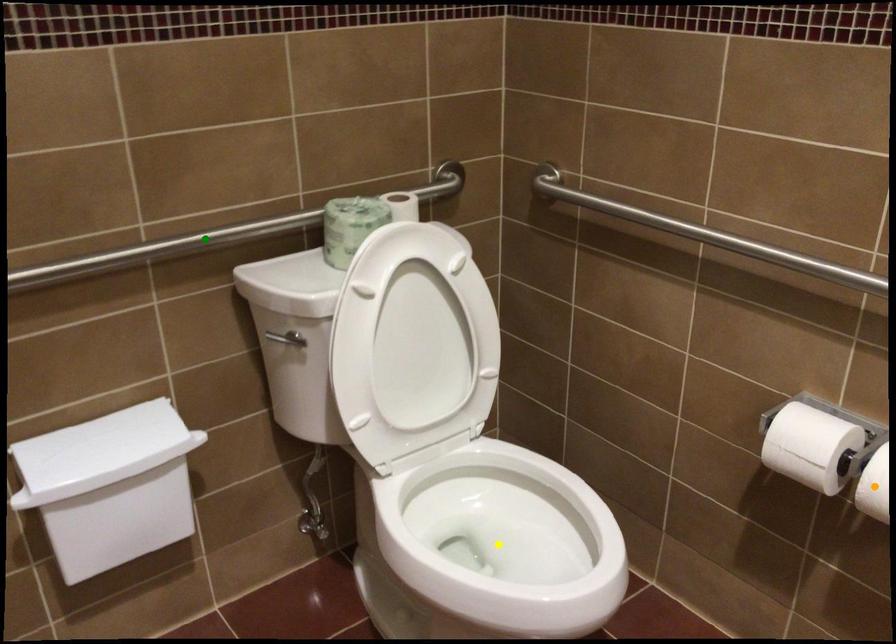
Order these from nearest to farthest:
orange point, yellow point, green point

yellow point → green point → orange point